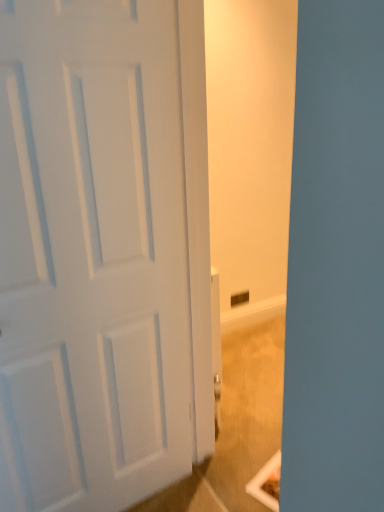
Locate an element on the screen. The width and height of the screenshot is (384, 512). white matte door at left is located at coordinates (92, 255).

The width and height of the screenshot is (384, 512). Describe the element at coordinates (92, 255) in the screenshot. I see `white matte door at left` at that location.

The height and width of the screenshot is (512, 384). In order to click on white matte door at left in this screenshot , I will do `click(92, 255)`.